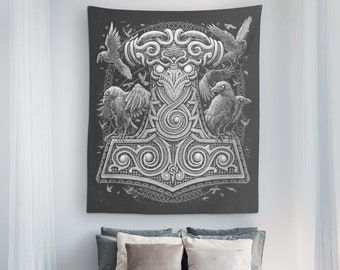
The image size is (340, 270). Find the location of `artwork`. artwork is located at coordinates (160, 17).